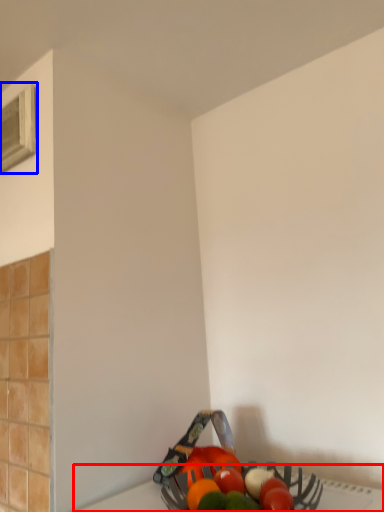
Question: Which object is further to the camera taking this photo, table top (highlighted by a red box) or window (highlighted by a blue box)?

Choices:
 (A) table top
 (B) window

Answer: (B)